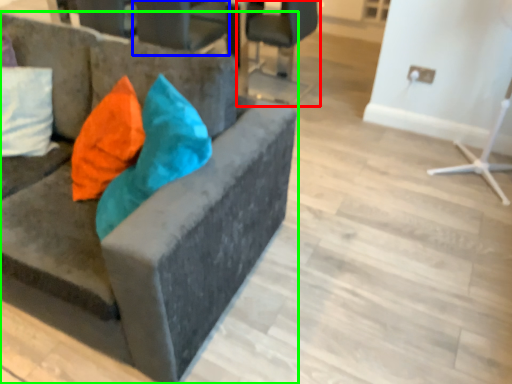
Question: Which is farther away from chair (highlighted by a red box)? chair (highlighted by a blue box) or chair (highlighted by a green box)?

Choices:
 (A) chair
 (B) chair

Answer: (B)